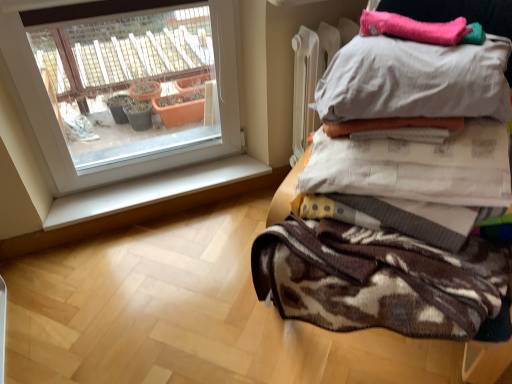
Image resolution: width=512 pixels, height=384 pixels. I want to click on free space in front of pink fuzzy blanket at upper right, which appears as the first blanket when viewed from the top, so click(x=433, y=55).